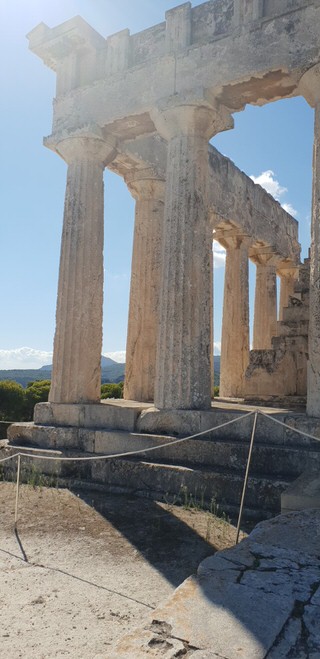
Locate an element on the screen. pillars is located at coordinates (82, 319).